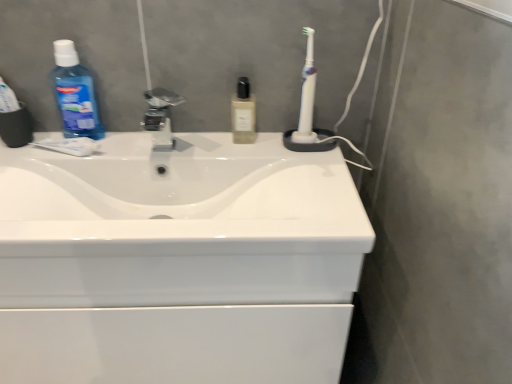
This screenshot has width=512, height=384. I want to click on white plastic toothbrush at upper right, so click(x=308, y=110).

The image size is (512, 384). What do you see at coordinates (308, 110) in the screenshot?
I see `white plastic toothbrush at upper right` at bounding box center [308, 110].

Measure the distance between blue translucent mouthwash at left and camera.

blue translucent mouthwash at left is 89.77 centimeters away from camera.

Find the location of `white plastic toothbrush at upper right`. white plastic toothbrush at upper right is located at coordinates (308, 110).

Considering the sizes of objects white plastic toothbrush at upper right and translucent glass bottle at center in the image provided, who is bigger, white plastic toothbrush at upper right or translucent glass bottle at center?

translucent glass bottle at center.

From the image's perspective, which is below, white plastic toothbrush at upper right or translucent glass bottle at center?

translucent glass bottle at center is shown below in the image.

Does point (308, 144) appear closer or farther from the camera than point (239, 108)?

Clearly, point (308, 144) is more distant from the camera than point (239, 108).

Who is shorter, satin nickel faucet at center or translucent glass bottle at center?

satin nickel faucet at center is shorter.

Find the location of a particular element. toiletry above the satin nickel faucet at center (from the image's perspective) is located at coordinates (243, 113).

Considering the sizes of objects satin nickel faucet at center and translucent glass bottle at center in the image provided, who is bigger, satin nickel faucet at center or translucent glass bottle at center?

translucent glass bottle at center is bigger.

Is satin nickel faucet at center not close to white glossy sink at center?

No, satin nickel faucet at center is not far away from white glossy sink at center.

Between satin nickel faucet at center and white glossy sink at center, which one appears on the right side from the viewer's perspective?

From the viewer's perspective, white glossy sink at center appears more on the right side.

Can you tell me how much satin nickel faucet at center and white glossy sink at center differ in facing direction?

The angular difference between satin nickel faucet at center and white glossy sink at center is 0.805 degrees.

From the picture: Is translucent glass bottle at center smaller than white plastic toothbrush at upper right?

No.

Is translucent glass bottle at center thinner than white plastic toothbrush at upper right?

Incorrect, the width of translucent glass bottle at center is not less than that of white plastic toothbrush at upper right.

Which is in front, translucent glass bottle at center or white plastic toothbrush at upper right?

Positioned in front is white plastic toothbrush at upper right.

From a real-world perspective, relative to white plastic toothbrush at upper right, is translucent glass bottle at center vertically above or below?

From a real-world perspective, translucent glass bottle at center is physically below white plastic toothbrush at upper right.

Is blue translucent mouthwash at left taller or shorter than satin nickel faucet at center?

In the image, blue translucent mouthwash at left appears to be taller than satin nickel faucet at center.

Which object is wider, blue translucent mouthwash at left or satin nickel faucet at center?

Wider between the two is blue translucent mouthwash at left.

Which is closer to the camera, [71,132] or [161,103]?

Point [71,132] appears to be farther away from the viewer than point [161,103].

From a real-world perspective, is blue translucent mouthwash at left physically located above or below satin nickel faucet at center?

From a real-world perspective, blue translucent mouthwash at left is physically above satin nickel faucet at center.

Choose the correct answer: Is white plastic toothbrush at upper right inside white glossy sink at center or outside it?

white plastic toothbrush at upper right is outside white glossy sink at center.

Does white plastic toothbrush at upper right have a greater width compared to white glossy sink at center?

In fact, white plastic toothbrush at upper right might be narrower than white glossy sink at center.

From the image's perspective, is white plastic toothbrush at upper right located above or below white glossy sink at center?

white plastic toothbrush at upper right is above white glossy sink at center.

Which of these two, white plastic toothbrush at upper right or white glossy sink at center, is smaller?

Smaller between the two is white plastic toothbrush at upper right.

Would you say blue translucent mouthwash at left is a long distance from translucent glass bottle at center?

That's not correct — blue translucent mouthwash at left is a little close to translucent glass bottle at center.

Considering their positions, is blue translucent mouthwash at left located in front of or behind translucent glass bottle at center?

Clearly, blue translucent mouthwash at left is in front of translucent glass bottle at center.

From a real-world perspective, is blue translucent mouthwash at left positioned under translucent glass bottle at center based on gravity?

No, from a real-world perspective, blue translucent mouthwash at left is not beneath translucent glass bottle at center.

Is blue translucent mouthwash at left completely or partially outside of translucent glass bottle at center?

Yes.

At what (x,y) coordinates should I click in order to perform the action: click on toiletry on the left of white plastic toothbrush at upper right. Please return your answer as a coordinate pair (x, y). The height and width of the screenshot is (384, 512). Looking at the image, I should click on (243, 113).

Image resolution: width=512 pixels, height=384 pixels. I want to click on tap that is under the translucent glass bottle at center (from a real-world perspective), so tap(160, 117).

Estimate the real-world distances between objects in this image. Which object is further from white glossy sink at center, translucent glass bottle at center or satin nickel faucet at center?

Based on the image, translucent glass bottle at center appears to be further to white glossy sink at center.

Considering their positions, is translucent glass bottle at center positioned further to white plastic toothbrush at upper right than satin nickel faucet at center?

Among the two, satin nickel faucet at center is located further to white plastic toothbrush at upper right.

From the image, which object appears to be nearer to satin nickel faucet at center, translucent glass bottle at center or blue translucent mouthwash at left?

blue translucent mouthwash at left is closer to satin nickel faucet at center.

From the image, which object appears to be nearer to white plastic toothbrush at upper right, white glossy sink at center or translucent glass bottle at center?

translucent glass bottle at center is positioned closer to the anchor white plastic toothbrush at upper right.

Estimate the real-world distances between objects in this image. Which object is further from white plastic toothbrush at upper right, white glossy sink at center or satin nickel faucet at center?

The object further to white plastic toothbrush at upper right is white glossy sink at center.

Estimate the real-world distances between objects in this image. Which object is further from white plastic toothbrush at upper right, translucent glass bottle at center or white glossy sink at center?

white glossy sink at center lies further to white plastic toothbrush at upper right than the other object.

Estimate the real-world distances between objects in this image. Which object is closer to satin nickel faucet at center, white plastic toothbrush at upper right or translucent glass bottle at center?

The object closer to satin nickel faucet at center is translucent glass bottle at center.

When comparing their distances from translucent glass bottle at center, does white glossy sink at center or blue translucent mouthwash at left seem further?

blue translucent mouthwash at left lies further to translucent glass bottle at center than the other object.

The image size is (512, 384). Identify the location of tap between blue translucent mouthwash at left and white plastic toothbrush at upper right from left to right. (160, 117).

Where is `sink situated between blue translucent mouthwash at left and translucent glass bottle at center from left to right`? The image size is (512, 384). sink situated between blue translucent mouthwash at left and translucent glass bottle at center from left to right is located at coordinates tap(179, 224).

Where is `toiletry between white plastic toothbrush at upper right and white glossy sink at center in the vertical direction`? This screenshot has height=384, width=512. toiletry between white plastic toothbrush at upper right and white glossy sink at center in the vertical direction is located at coordinates (243, 113).

This screenshot has width=512, height=384. Find the location of `tap between translucent glass bottle at center and white glossy sink at center from top to bottom`. tap between translucent glass bottle at center and white glossy sink at center from top to bottom is located at coordinates (160, 117).